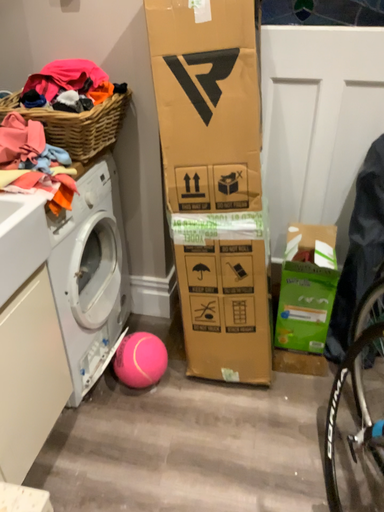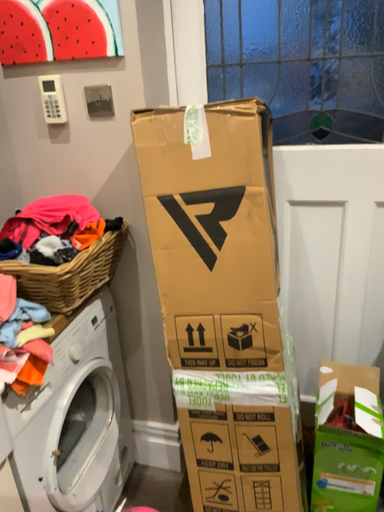
Question: How did the camera likely rotate when shooting the video?

Choices:
 (A) rotated downward
 (B) rotated upward

Answer: (B)